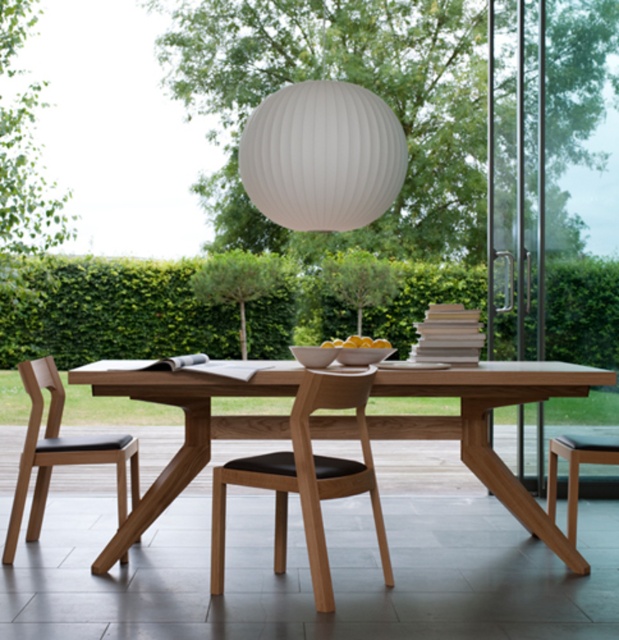
Who is positioned more to the right, natural wood table at center or light brown wood chair at center?

Positioned to the right is natural wood table at center.

Measure the distance between point (516, 513) and camera.

Point (516, 513) is 4.15 meters away from camera.

I want to click on natural wood table at center, so click(487, 424).

Is the position of light brown wood chair at center less distant than that of light brown wood stool at lower right?

That is True.

Can you confirm if light brown wood chair at center is thinner than light brown wood stool at lower right?

Incorrect, light brown wood chair at center's width is not less than light brown wood stool at lower right's.

At what (x,y) coordinates should I click in order to perform the action: click on light brown wood chair at center. Please return your answer as a coordinate pair (x, y). The width and height of the screenshot is (619, 640). Looking at the image, I should click on tap(305, 481).

Locate an element on the screen. This screenshot has height=640, width=619. light brown wood chair at center is located at coordinates (305, 481).

Can you confirm if light brown wood chair at center is wider than natural wood chair at left?

Indeed, light brown wood chair at center has a greater width compared to natural wood chair at left.

Which is behind, point (215, 468) or point (51, 396)?

Point (51, 396)

Is point (357, 467) positioned behind point (48, 484)?

No, (357, 467) is in front of (48, 484).

The image size is (619, 640). I want to click on light brown wood chair at center, so click(x=305, y=481).